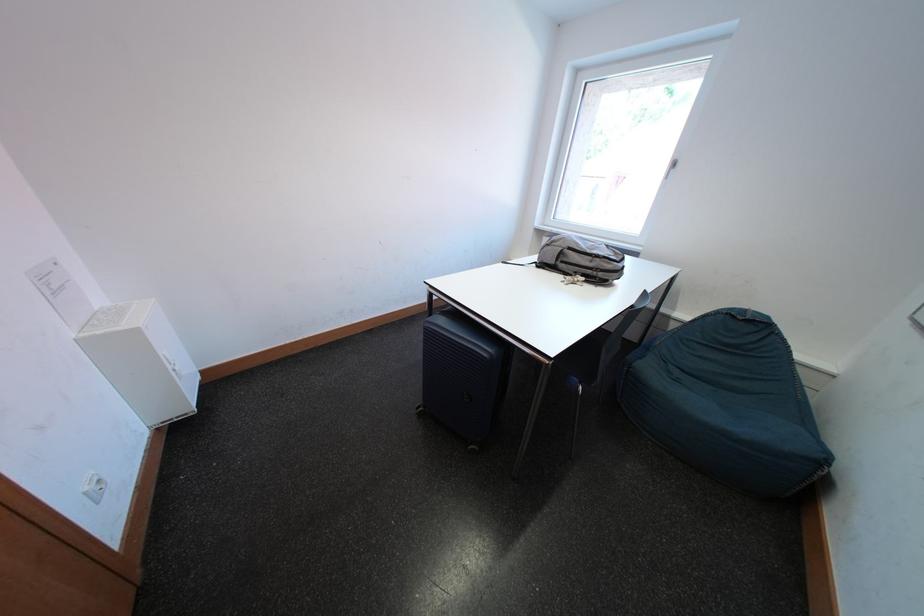
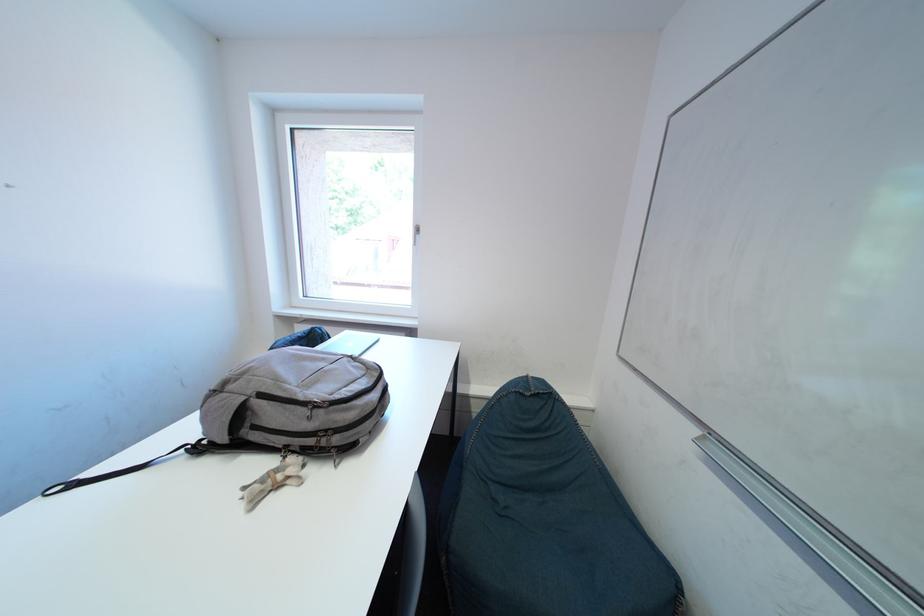
Question: The camera is either moving clockwise (left) or counter-clockwise (right) around the object. The first image is from the beginning of the video and the second image is from the end. Is the camera moving left or right when shooting the video?

Choices:
 (A) Left
 (B) Right

Answer: (A)